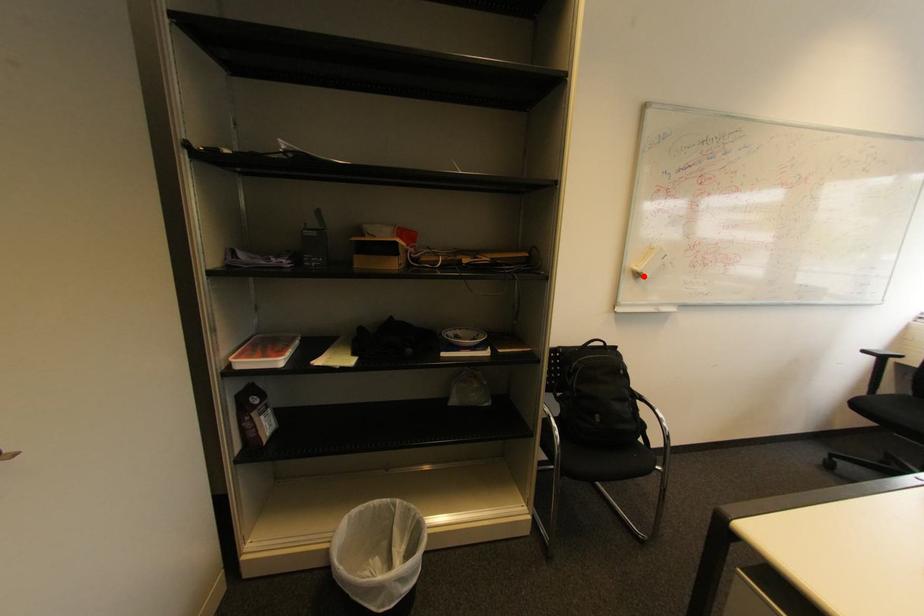
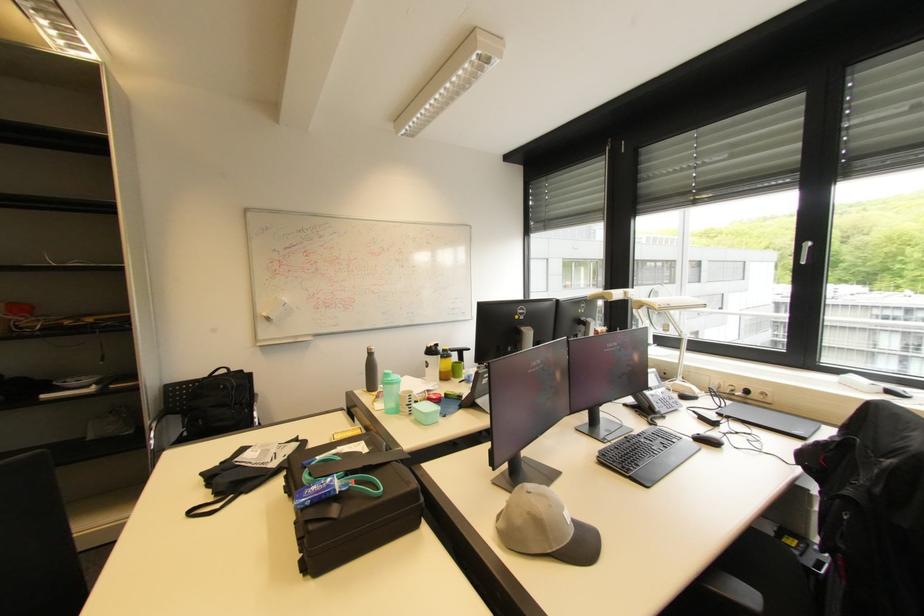
Question: I am providing you with two images of the same scene from different viewpoints. In image1, a red point is highlighted. Considering the same 3D point in image2, which of the following is correct?

Choices:
 (A) It is closer
 (B) It is farther

Answer: (B)